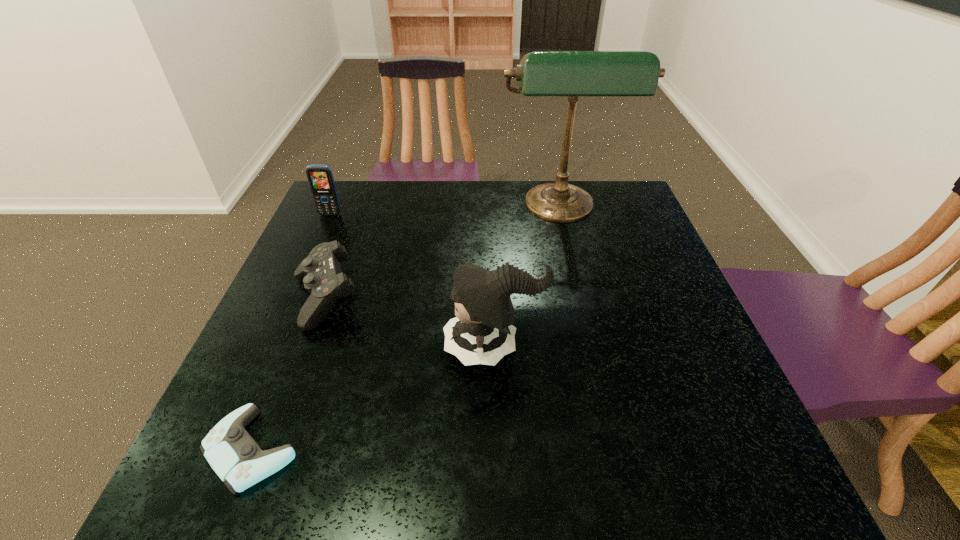
The height and width of the screenshot is (540, 960). Identify the location of vacant space located at the face of the fourth shortest object. (363, 347).

Locate an element on the screen. The image size is (960, 540). free space located on the screen of the third tallest object is located at coordinates (301, 279).

The image size is (960, 540). What are the coordinates of `vacant space located on the front of the second shortest object` in the screenshot? It's located at (288, 399).

Identify the location of vacant area situated 0.080m on the back of the nearest object. This screenshot has width=960, height=540. (283, 374).

You are a GUI agent. You are given a task and a screenshot of the screen. Output one action in this format:
    pyautogui.click(x=<x>, y=<y>)
    Task: Click on the table lamp that is at the far edge
    This screenshot has height=540, width=960.
    Given the screenshot: What is the action you would take?
    pyautogui.click(x=541, y=73)

Identify the location of cellular telephone at the far edge. coord(320,177).

Image resolution: width=960 pixels, height=540 pixels. I want to click on object located in the near edge section of the desktop, so click(x=233, y=454).

The width and height of the screenshot is (960, 540). I want to click on cellular telephone that is positioned at the left edge, so click(320, 177).

Where is `object that is at the right edge`? The image size is (960, 540). object that is at the right edge is located at coordinates (541, 73).

Locate an element on the screen. This screenshot has width=960, height=540. object situated at the far left corner is located at coordinates (320, 177).